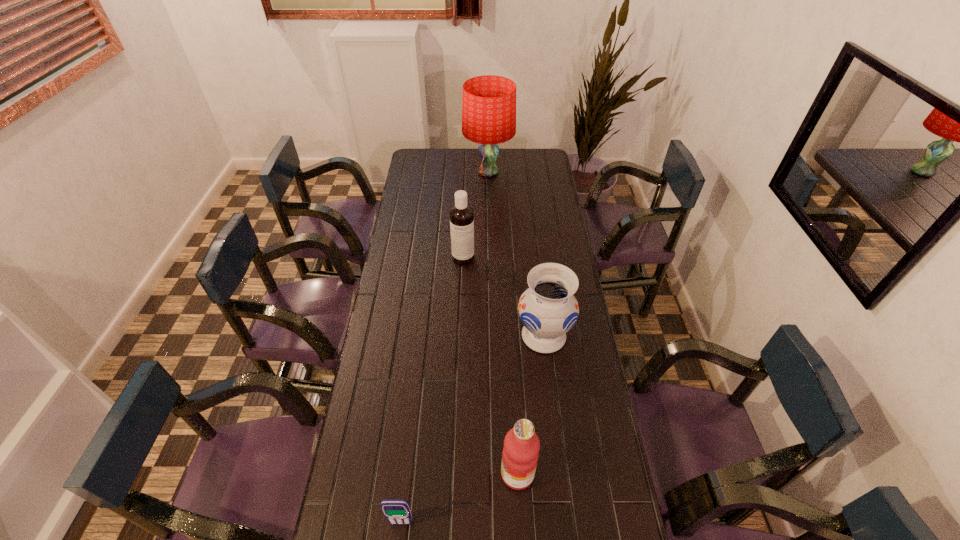
Locate an element on the screen. The image size is (960, 540). free space located on the label of the fruit juice is located at coordinates (401, 474).

Identify the location of vacant space situated on the label of the fruit juice. This screenshot has width=960, height=540. (419, 474).

The height and width of the screenshot is (540, 960). Find the location of `vacant space located 0.110m on the label of the fruit juice`. vacant space located 0.110m on the label of the fruit juice is located at coordinates (463, 474).

Where is `object that is positioned at the far edge`? This screenshot has width=960, height=540. object that is positioned at the far edge is located at coordinates (489, 102).

Locate an element on the screen. This screenshot has height=540, width=960. object positioned at the left edge is located at coordinates (396, 511).

Where is `object located at the right edge`? This screenshot has height=540, width=960. object located at the right edge is located at coordinates [x=548, y=309].

The image size is (960, 540). Find the location of `vacant space at the far edge of the desktop`. vacant space at the far edge of the desktop is located at coordinates (474, 163).

The width and height of the screenshot is (960, 540). In the image, there is a desktop. In order to click on vacant space at the left edge in this screenshot , I will do `click(423, 262)`.

This screenshot has width=960, height=540. In the image, there is a desktop. Identify the location of free region at the right edge. (539, 207).

Locate an element on the screen. vacant region at the far right corner of the desktop is located at coordinates (528, 168).